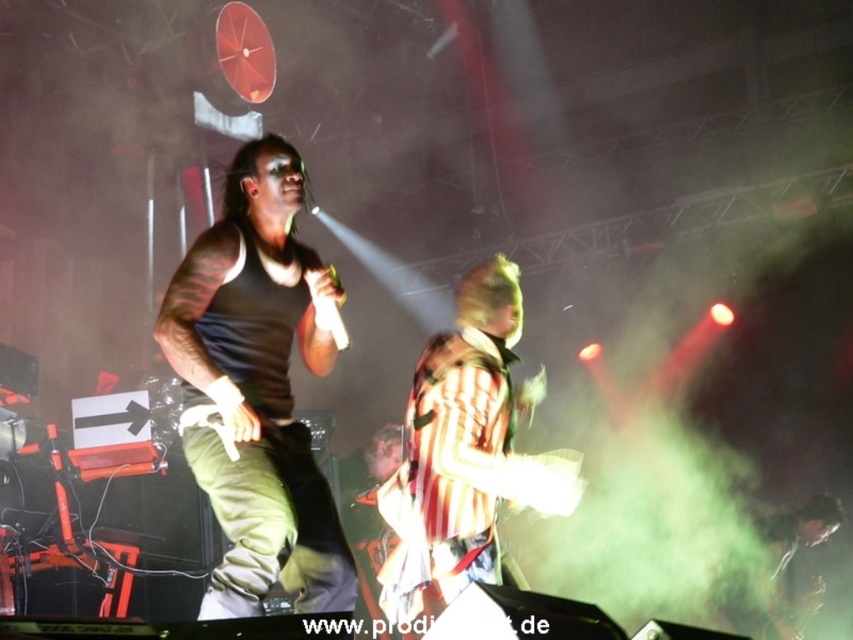
Which of these two, black matte tank top at center or striped shirt at center, stands taller?

black matte tank top at center

Is black matte tank top at center to the left of striped shirt at center from the viewer's perspective?

Correct, you'll find black matte tank top at center to the left of striped shirt at center.

Is point (173, 355) positioned behind point (488, 364)?

No, it is not.

You are a GUI agent. You are given a task and a screenshot of the screen. Output one action in this format:
    pyautogui.click(x=<x>, y=<y>)
    Task: Click on the black matte tank top at center
    The width and height of the screenshot is (853, 640).
    Given the screenshot: What is the action you would take?
    pyautogui.click(x=257, y=388)

Describe the element at coordinates (463, 452) in the screenshot. This screenshot has height=640, width=853. I see `striped shirt at center` at that location.

Is point (480, 333) closer to viewer compared to point (796, 531)?

Yes, point (480, 333) is in front of point (796, 531).

You are a GUI agent. You are given a task and a screenshot of the screen. Output one action in this format:
    pyautogui.click(x=<x>, y=<y>)
    Task: Click on the striped shirt at center
    The image size is (853, 640).
    Given the screenshot: What is the action you would take?
    pyautogui.click(x=463, y=452)

Between black matte tank top at center and shiny black hair at center, which one appears on the left side from the viewer's perspective?

Positioned to the left is black matte tank top at center.

Can you confirm if black matte tank top at center is positioned below shiny black hair at center?

No, black matte tank top at center is not below shiny black hair at center.

What are the coordinates of `black matte tank top at center` in the screenshot? It's located at (257, 388).

Find the location of `black matte tank top at center`. black matte tank top at center is located at coordinates (257, 388).